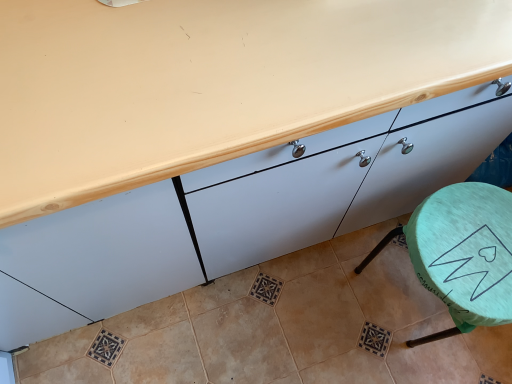
Question: From the image's perspective, is green fabric stool at lower right located above or below matte white cabinet at center?

Choices:
 (A) above
 (B) below

Answer: (B)

Question: Is point (424, 284) positioned closer to the camera than point (132, 264)?

Choices:
 (A) closer
 (B) farther

Answer: (B)

Question: Considering the positions of green fabric stool at lower right and matte white cabinet at center in the image, is green fabric stool at lower right wider or thinner than matte white cabinet at center?

Choices:
 (A) wide
 (B) thin

Answer: (B)

Question: From the image's perspective, is matte white cabinet at center positioned above or below green fabric stool at lower right?

Choices:
 (A) above
 (B) below

Answer: (A)

Question: Based on their sizes in the image, would you say matte white cabinet at center is bigger or smaller than green fabric stool at lower right?

Choices:
 (A) big
 (B) small

Answer: (A)

Question: Visually, is matte white cabinet at center positioned to the left or to the right of green fabric stool at lower right?

Choices:
 (A) right
 (B) left

Answer: (B)

Question: Is point (331, 188) closer or farther from the camera than point (485, 284)?

Choices:
 (A) closer
 (B) farther

Answer: (B)